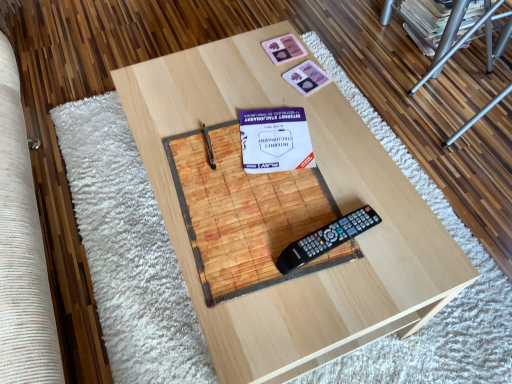
Locate an element on the screen. Image resolution: width=512 pixels, height=384 pixels. free location in front of white paper at center is located at coordinates (277, 205).